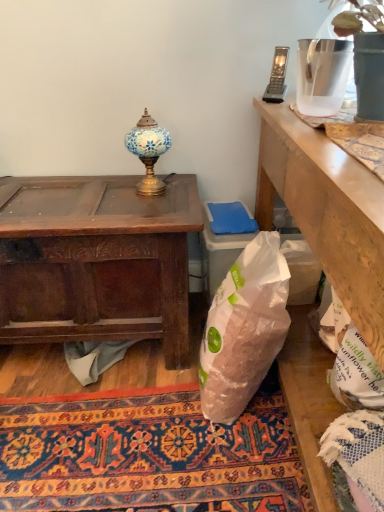
This screenshot has width=384, height=512. I want to click on blank space to the left of mosaic glass lamp at upper center, so click(112, 186).